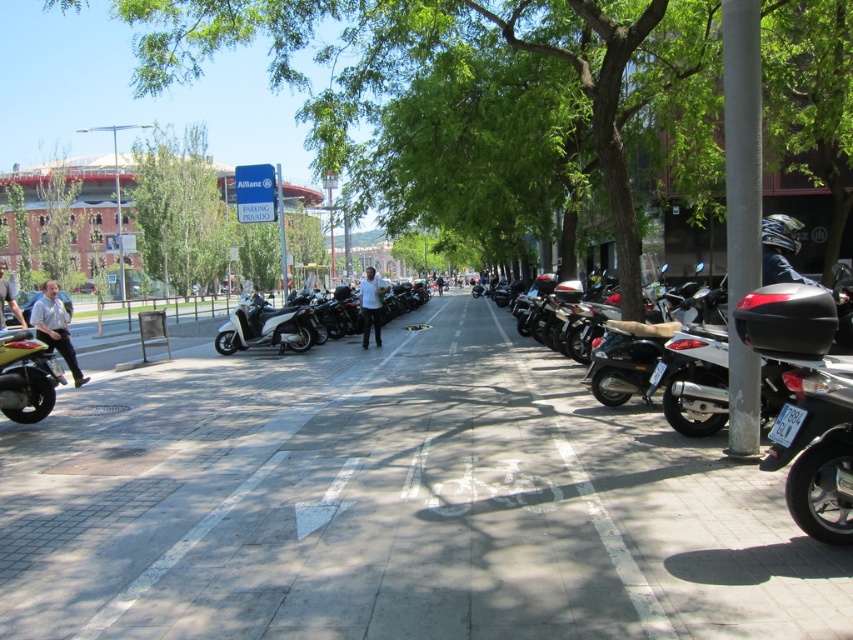
You are a delivery rider who needs to park your motorcycle in a spot that can accommodate your vehicle. You see a black matte motorcycle at right and a white glossy scooter at center. Which parking spot should you choose to ensure your motorcycle fits?

The black matte motorcycle at right occupies less space than the white glossy scooter at center, so you should choose the parking spot for the white glossy scooter at center to ensure your motorcycle fits.

You are a delivery drone flying above the city. Your mission requires you to land on the gray concrete pavement at center. What are the coordinates where you should land?

The gray concrete pavement at center is located at coordinates point (393,504), so you should land there.

You are a delivery driver who needs to park your motorcycle in the parking area on the right side of the street. There is a black matte motorcycle at right already parked there. The parking space is 25 feet long. Can you park your motorcycle there?

The black matte motorcycle at right is 22.06 feet away from you, so yes, there is enough space in the parking area on the right side of the street to park your motorcycle since the parking space is 25 feet long and the distance between the motorcycles is within the limit.